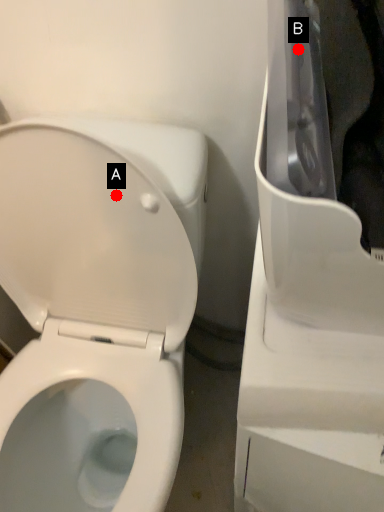
Question: Two points are circled on the image, labeled by A and B beside each circle. Which point is closer to the camera taking this photo?

Choices:
 (A) A is closer
 (B) B is closer

Answer: (B)